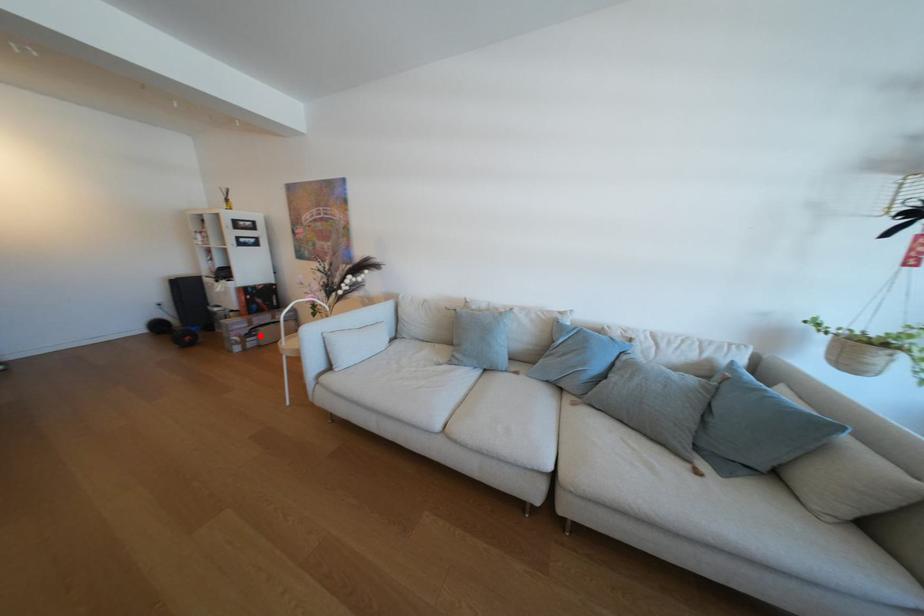
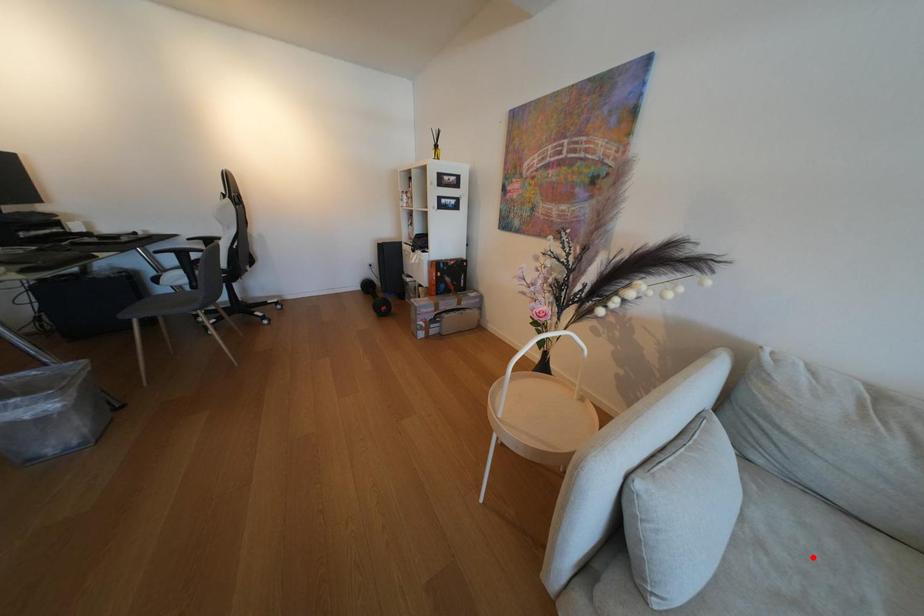
I am providing you with two images of the same scene from different viewpoints. A red point is marked on the first image and another point is marked on the second image. Does the point marked in image1 correspond to the same location as the one in image2?

No